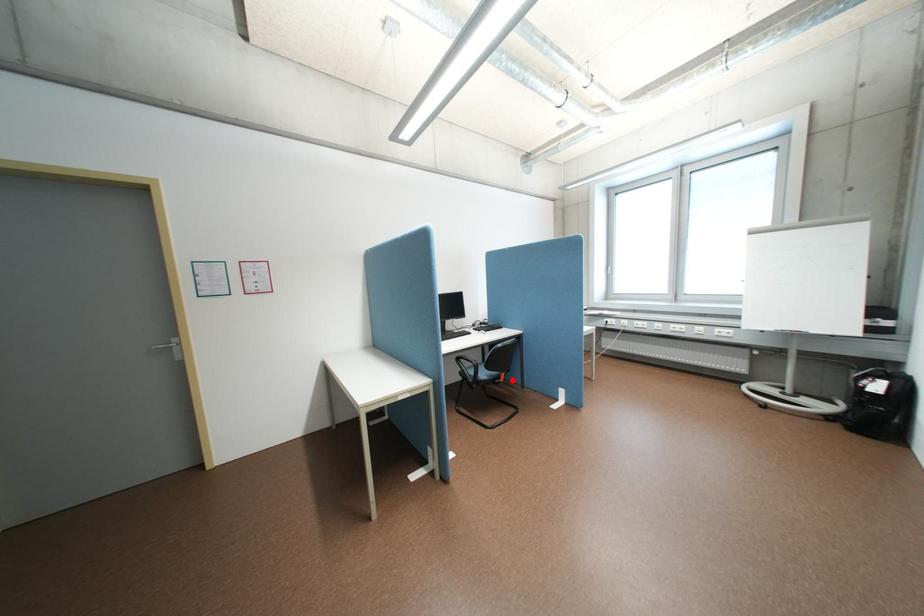
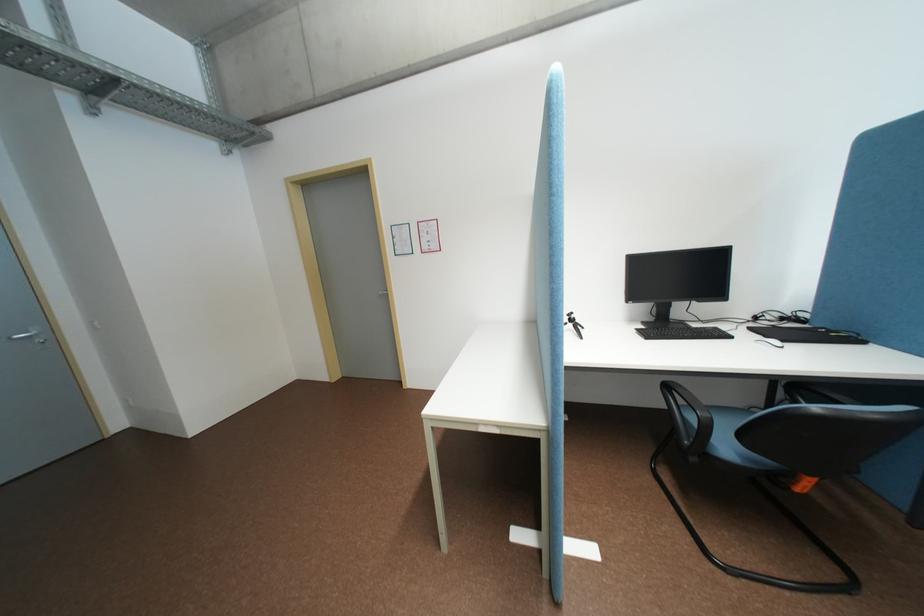
Question: A red point is marked in image1. In image2, is the corresponding 3D point closer to the camera or farther? Reply with the corresponding letter.

Choices:
 (A) The corresponding 3D point is closer.
 (B) The corresponding 3D point is farther.

Answer: (A)